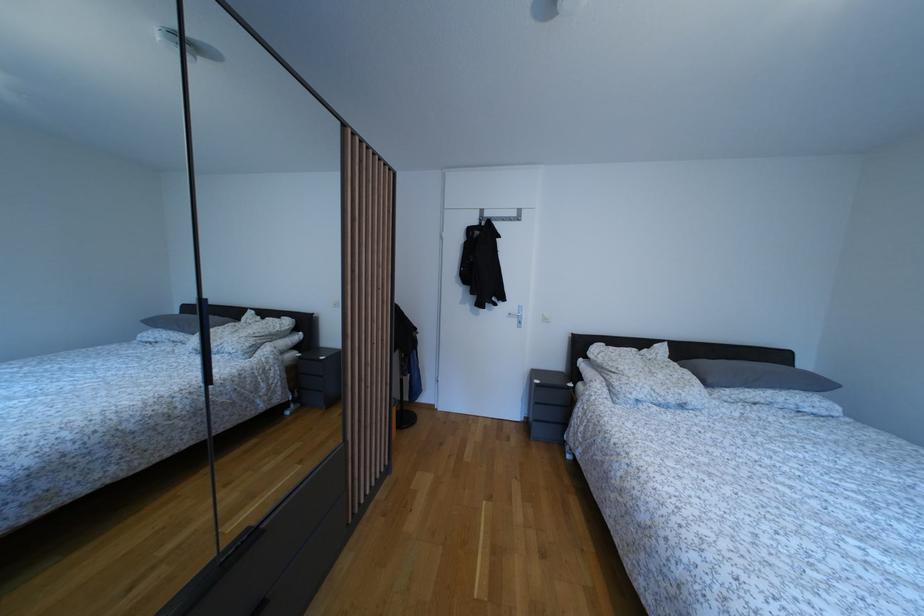
I want to click on dark grey drawer, so click(x=239, y=549).